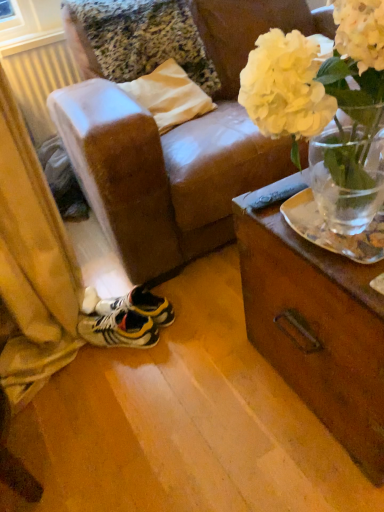
Question: Would you say yellow and black synthetic sneakers at lower left is inside or outside white matte vase at upper right?

Choices:
 (A) outside
 (B) inside

Answer: (A)

Question: In terms of size, does yellow and black synthetic sneakers at lower left appear bigger or smaller than white matte vase at upper right?

Choices:
 (A) small
 (B) big

Answer: (A)

Question: Which of these objects is positioned farthest from the white plastic radiator at left?

Choices:
 (A) white matte vase at upper right
 (B) yellow and black synthetic sneakers at lower left

Answer: (A)

Question: Which of these objects is positioned closest to the white matte vase at upper right?

Choices:
 (A) yellow and black synthetic sneakers at lower left
 (B) white plastic radiator at left

Answer: (A)